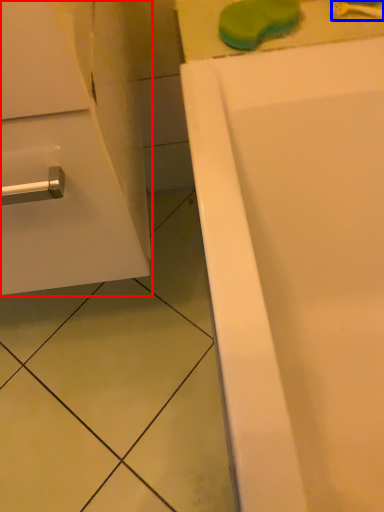
Question: Which point is further to the camera, bathroom cabinet (highlighted by a red box) or toothbrush (highlighted by a blue box)?

Choices:
 (A) bathroom cabinet
 (B) toothbrush

Answer: (B)